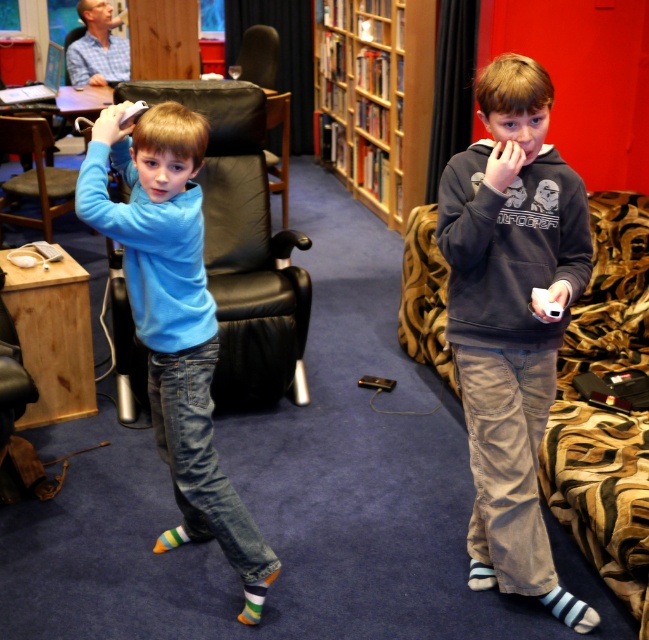
The height and width of the screenshot is (640, 649). What are the coordinates of `dark gray hoodie at center` in the screenshot? It's located at (511, 320).

Consider the image. Does dark gray hoodie at center have a smaller size compared to black leather chair at center?

Indeed, dark gray hoodie at center has a smaller size compared to black leather chair at center.

Find the location of a particular element. dark gray hoodie at center is located at coordinates (511, 320).

Where is `dark gray hoodie at center`? dark gray hoodie at center is located at coordinates (511, 320).

Can you confirm if black leather armchair at center is positioned to the right of dark gray hoodie at right?

Incorrect, black leather armchair at center is not on the right side of dark gray hoodie at right.

Consider the image. Is black leather armchair at center positioned at the back of dark gray hoodie at right?

Yes, black leather armchair at center is behind dark gray hoodie at right.

Find the location of a particular element. black leather armchair at center is located at coordinates (241, 246).

Is blue cotton shirt at center below black leather armchair at center?

Yes.

Does blue cotton shirt at center have a greater height compared to black leather armchair at center?

Incorrect, blue cotton shirt at center's height is not larger of black leather armchair at center's.

Does point (164, 140) come closer to viewer compared to point (225, 182)?

Yes, it is.

You are a GUI agent. You are given a task and a screenshot of the screen. Output one action in this format:
    pyautogui.click(x=<x>, y=<y>)
    Task: Click on the blue cotton shirt at center
    
    Given the screenshot: What is the action you would take?
    pos(173,320)